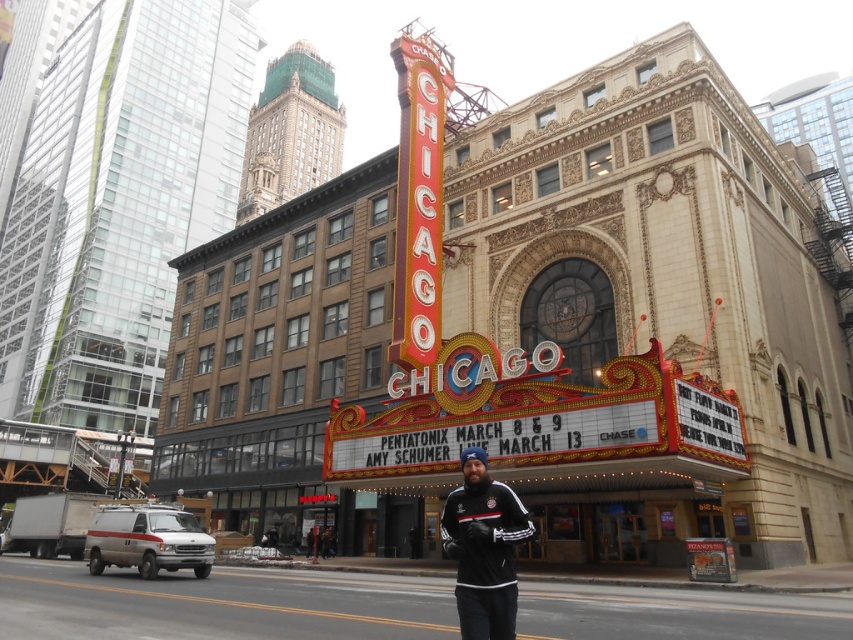
Question: Which object is closer to the camera taking this photo?

Choices:
 (A) black fleece jacket at center
 (B) marble theater at center

Answer: (A)

Question: Which point is farther from the camera taking this photo?

Choices:
 (A) (711, 209)
 (B) (465, 451)

Answer: (A)

Question: Can you confirm if marble theater at center is positioned to the right of black fleece jacket at center?

Choices:
 (A) yes
 (B) no

Answer: (B)

Question: Considering the relative positions of marble theater at center and black fleece jacket at center in the image provided, where is marble theater at center located with respect to black fleece jacket at center?

Choices:
 (A) above
 (B) below

Answer: (A)

Question: Does marble theater at center have a lesser width compared to black fleece jacket at center?

Choices:
 (A) no
 (B) yes

Answer: (A)